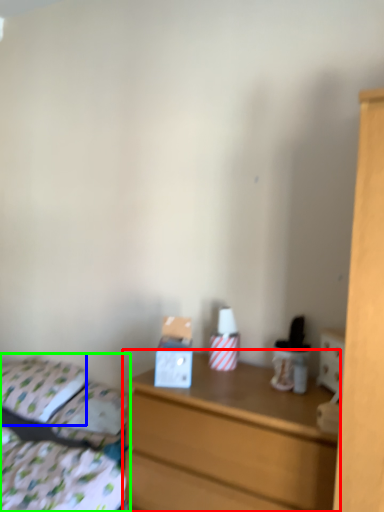
Question: Based on their relative distances, which object is nearer to chest of drawers (highlighted by a red box)? Choose from pillow (highlighted by a blue box) and bed (highlighted by a green box).

Choices:
 (A) pillow
 (B) bed

Answer: (B)